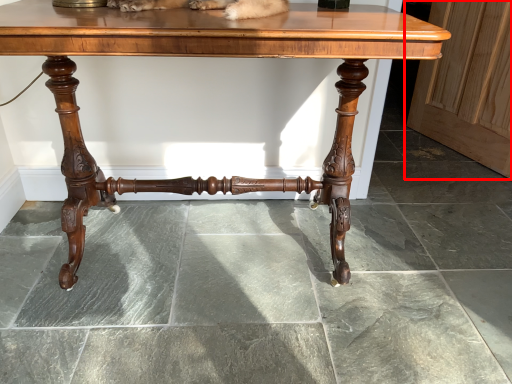
Question: Considering the relative positions of screen door (annotated by the red box) and table in the image provided, where is screen door (annotated by the red box) located with respect to the staircase?

Choices:
 (A) right
 (B) left

Answer: (A)